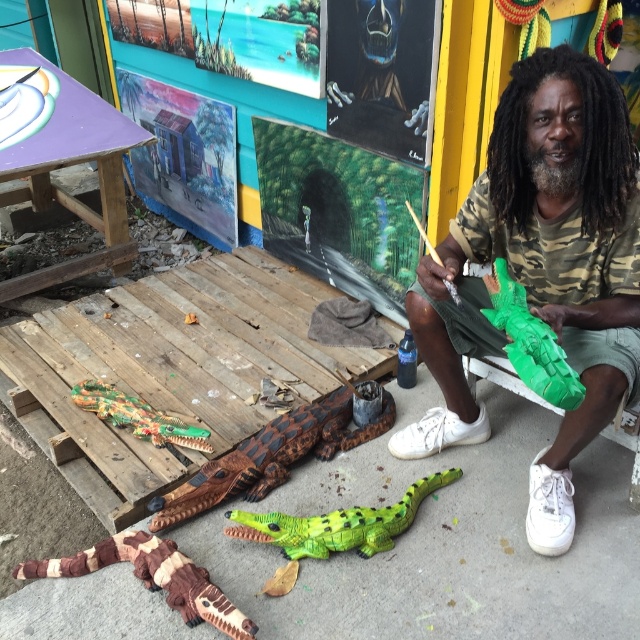
Question: Is green matte crocodile at center below green plastic lizard at lower center?

Choices:
 (A) no
 (B) yes

Answer: (A)

Question: Which of the following is the closest to the observer?

Choices:
 (A) brown textured crocodile at lower left
 (B) green matte plastic crocodile at center
 (C) green plastic lizard at lower center

Answer: (B)

Question: Where is green plastic lizard at lower center located in relation to green matte plastic crocodile at center in the image?

Choices:
 (A) right
 (B) left

Answer: (B)

Question: Based on their relative distances, which object is nearer to the brown textured crocodile at lower left?

Choices:
 (A) green plastic lizard at lower center
 (B) green matte crocodile at center

Answer: (A)

Question: Does green matte crocodile at center appear under brown textured crocodile at lower left?

Choices:
 (A) yes
 (B) no

Answer: (B)

Question: Which object is farther from the camera taking this photo?

Choices:
 (A) green matte crocodile at center
 (B) green matte plastic crocodile at center
 (C) green plastic lizard at lower center

Answer: (C)